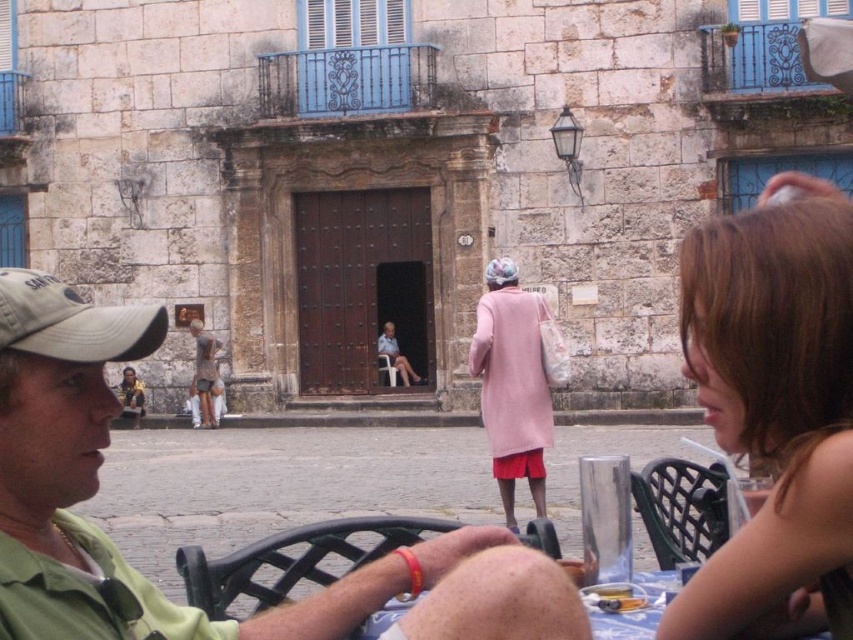
You are a photographer standing at the camera position. You want to take a closeup shot of the pink fabric coat at center. Can you estimate whether the coat is within the typical focus range of a standard camera lens?

The pink fabric coat at center is 39.67 meters from camera. A standard camera lens typically has a focus range up to 10 meters, so the coat is too far away to be captured in focus.

You are a delivery person who needs to place a small package on the table between the pink fabric coat at center and the brown wooden statue at center. Which object should you place the package closer to if you want it to be near the smaller item?

The brown wooden statue at center is smaller than the pink fabric coat at center, so you should place the package closer to the brown wooden statue at center.